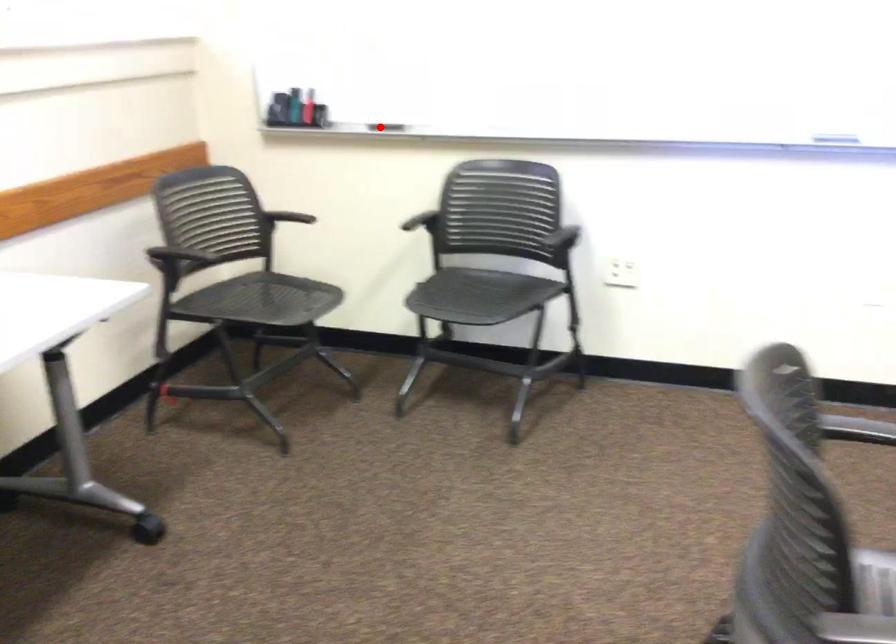
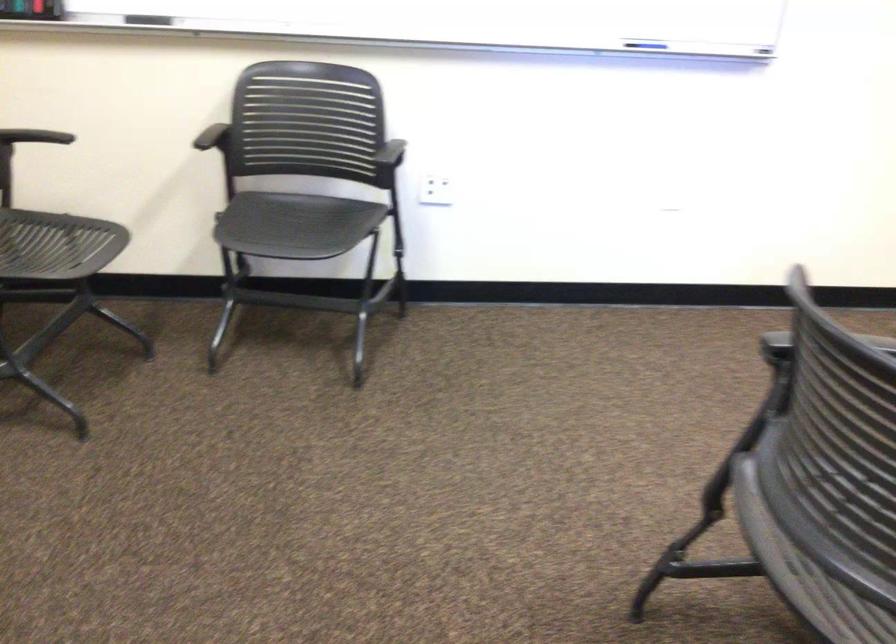
Question: I am providing you with two images of the same scene from different viewpoints. A red point is marked on the first image. Can you still see the location of the red point in image 2?

Choices:
 (A) Yes
 (B) No

Answer: (A)